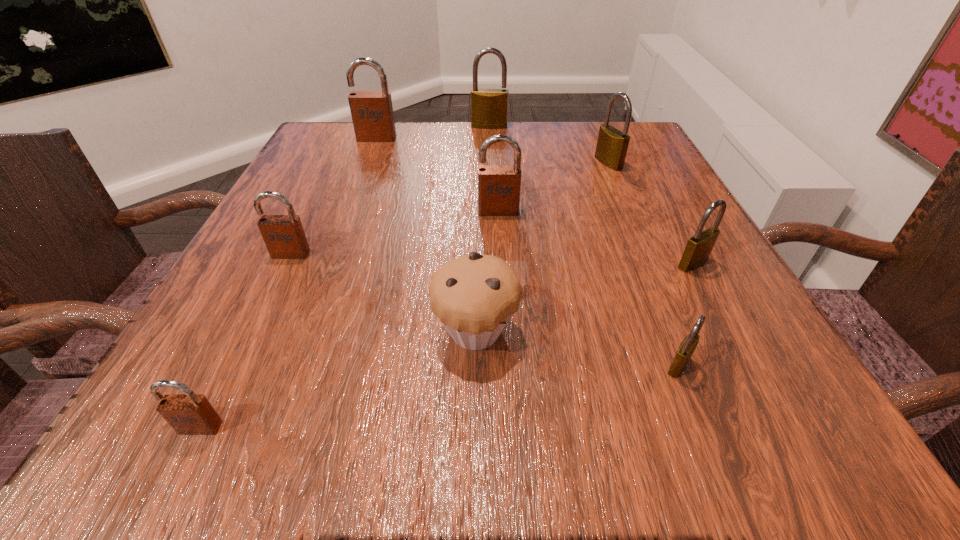
Locate an element on the screen. free space between the second biggest brass padlock and the second biggest brown padlock is located at coordinates (x=553, y=187).

This screenshot has height=540, width=960. In order to click on vacant point located between the third biggest brown padlock and the nearest padlock in this screenshot , I will do `click(246, 340)`.

Locate an element on the screen. The height and width of the screenshot is (540, 960). free space between the seventh nearest object and the farthest padlock is located at coordinates (549, 145).

Where is `free area in between the seventh farthest padlock and the second biggest brass padlock`? The height and width of the screenshot is (540, 960). free area in between the seventh farthest padlock and the second biggest brass padlock is located at coordinates (643, 264).

Where is `unoccupied area between the nearest brass padlock and the smallest brown padlock`? This screenshot has width=960, height=540. unoccupied area between the nearest brass padlock and the smallest brown padlock is located at coordinates (440, 396).

Locate which object ranks third in proximity to the second nearest brown padlock. Please provide its 2D coordinates. Your answer should be formatted as a tuple, i.e. [(x, y)], where the tuple contains the x and y coordinates of a point satisfying the conditions above.

[(499, 186)]

I want to click on object identified as the fifth closest to the fourth farthest object, so click(x=372, y=114).

This screenshot has height=540, width=960. Find the location of `padlock that is the sixth closest to the second farthest object`. padlock that is the sixth closest to the second farthest object is located at coordinates (188, 414).

Choose which padlock is the fifth nearest neighbor to the muffin. Please provide its 2D coordinates. Your answer should be formatted as a tuple, i.e. [(x, y)], where the tuple contains the x and y coordinates of a point satisfying the conditions above.

[(698, 249)]

This screenshot has height=540, width=960. What are the coordinates of `brass padlock that stands as the second closest to the seventh farthest padlock` in the screenshot? It's located at (611, 149).